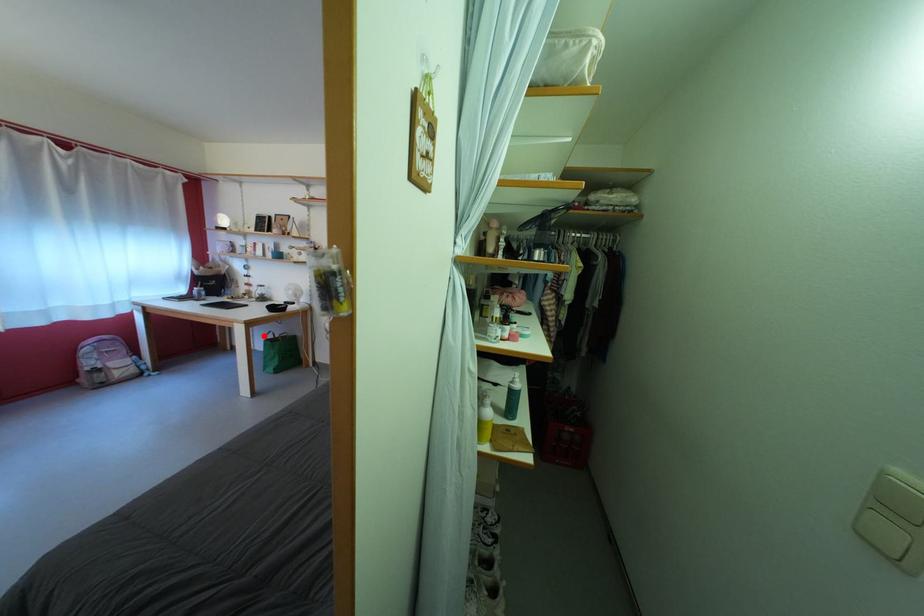
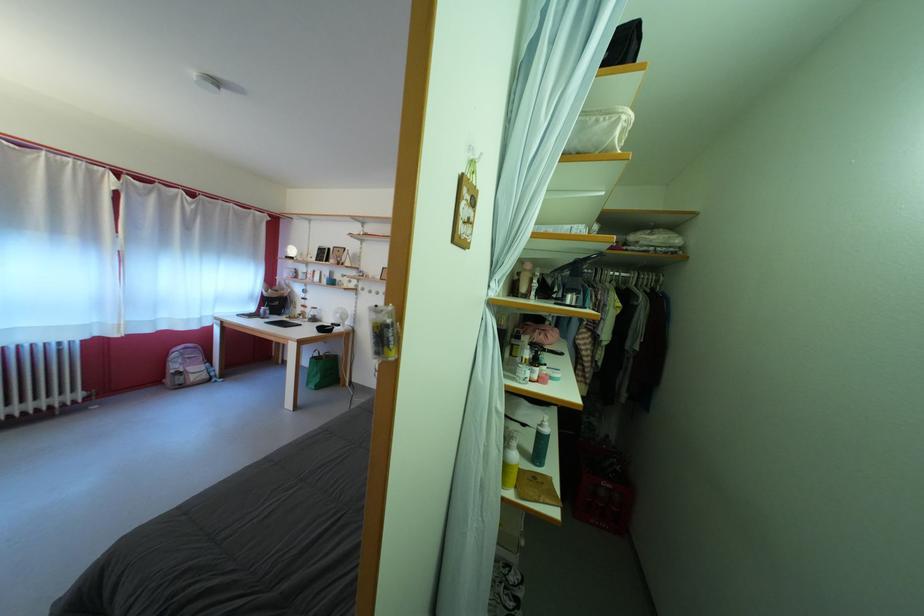
Question: I am providing you with two images of the same scene from different viewpoints. A red point is shown in image1. For the corresponding object point in image2, is it positioned nearer or farther from the camera?

Choices:
 (A) Nearer
 (B) Farther

Answer: (B)